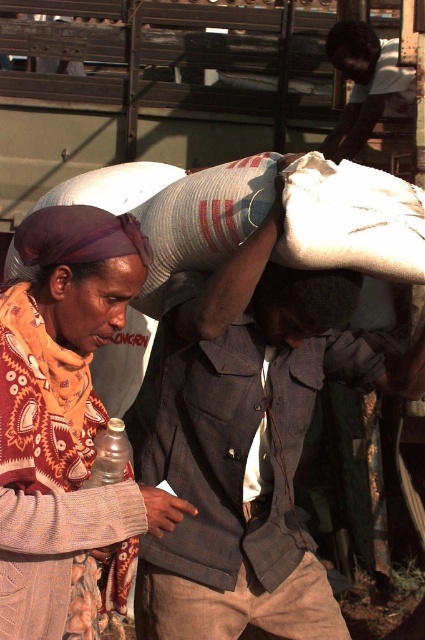
Is knitted wool scarf at left to the left of dark fabric head at center from the viewer's perspective?

Yes, knitted wool scarf at left is to the left of dark fabric head at center.

Which is behind, point (82, 280) or point (277, 289)?

The point (277, 289) is behind.

Does point (23, 508) lie behind point (268, 300)?

No, it is not.

Find the location of `knitted wool scarf at left`. knitted wool scarf at left is located at coordinates (64, 412).

From the picture: Is purple fabric headscarf at center to the right of black hair at upper center from the viewer's perspective?

In fact, purple fabric headscarf at center is to the left of black hair at upper center.

Locate an element on the screen. The image size is (425, 640). purple fabric headscarf at center is located at coordinates (85, 268).

Is purple fabric headscarf at center closer to camera compared to dark brown skin at center?

Yes, it is in front of dark brown skin at center.

Does purple fabric headscarf at center have a smaller size compared to dark brown skin at center?

Yes, purple fabric headscarf at center is smaller than dark brown skin at center.

Image resolution: width=425 pixels, height=640 pixels. What do you see at coordinates (85, 268) in the screenshot?
I see `purple fabric headscarf at center` at bounding box center [85, 268].

Where is `purple fabric headscarf at center`? This screenshot has width=425, height=640. purple fabric headscarf at center is located at coordinates (85, 268).